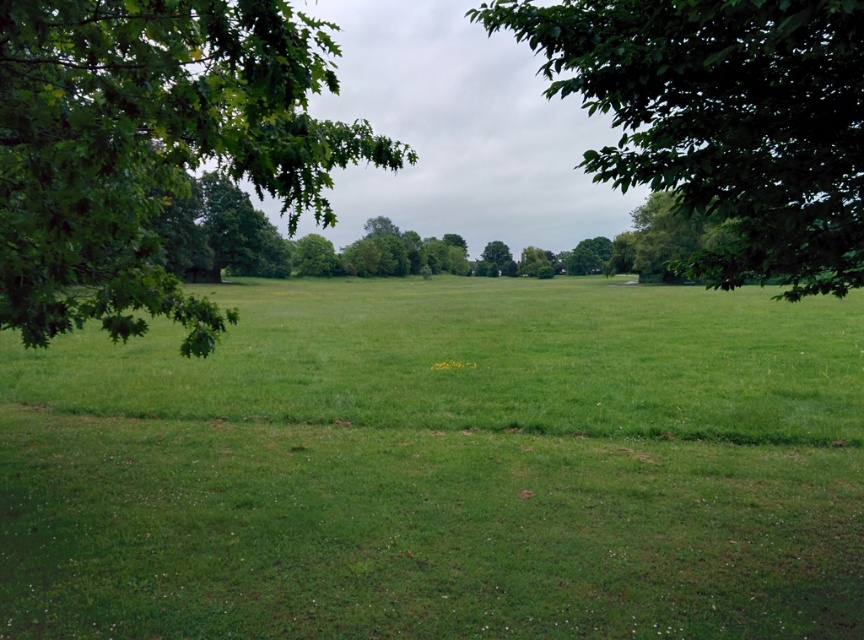
You are a gardener planning to plant a new row of flowers between the green grass at center and the green leafy tree at left. Based on their widths, which area should you choose to ensure the flowers have enough space to grow?

The green grass at center is wider than the green leafy tree at left, so you should choose the area near the green grass at center to plant the flowers for sufficient space.

In the scene shown: You are standing in the middle of the field and want to take a photo of the green leafy tree at left without the green grass at center appearing in the foreground. Is it possible to do so by moving closer to the tree?

The green grass at center is located below the green leafy tree at left, so moving closer to the tree would still have the green grass at center in the foreground. You would need to position yourself behind the tree to avoid the grass in the foreground.